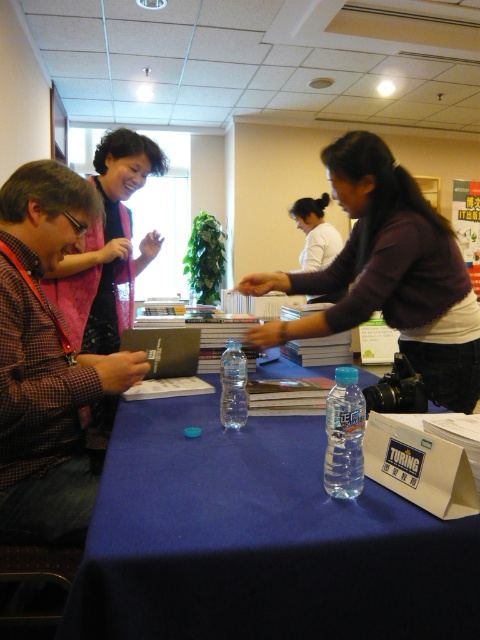
Which is in front, point (414, 525) or point (360, 456)?

Point (414, 525) is more forward.

Locate an element on the screen. The height and width of the screenshot is (640, 480). blue fabric tablecloth at center is located at coordinates (259, 540).

Between point (310, 524) and point (342, 436), which one is positioned in front?

Point (310, 524)

Locate an element on the screen. blue fabric tablecloth at center is located at coordinates (259, 540).

Is brown checkered shirt at left to the right of clear plastic bottle at table center from the viewer's perspective?

No, brown checkered shirt at left is not to the right of clear plastic bottle at table center.

Where is `brown checkered shirt at left`? The width and height of the screenshot is (480, 640). brown checkered shirt at left is located at coordinates (48, 364).

Identify the location of brown checkered shirt at left. (48, 364).

Can you confirm if clear plastic water bottle at center is shorter than clear plastic bottle at table center?

Answer: No.

The image size is (480, 640). I want to click on clear plastic water bottle at center, so click(x=345, y=435).